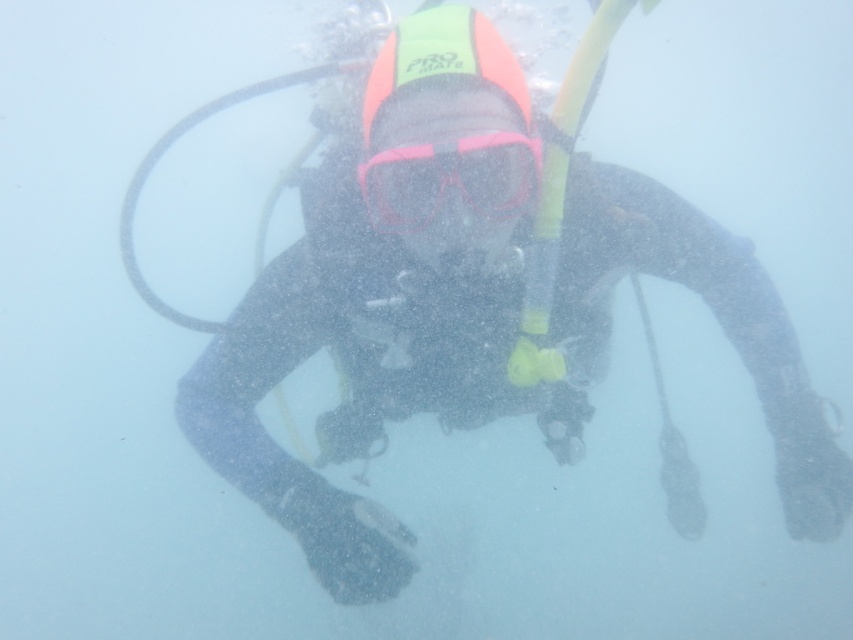
Question: Is black matte wetsuit at center positioned in front of pink matte/glossy goggles at center?

Choices:
 (A) no
 (B) yes

Answer: (A)

Question: Does black matte wetsuit at center have a lesser width compared to pink matte/glossy goggles at center?

Choices:
 (A) no
 (B) yes

Answer: (A)

Question: Does black matte wetsuit at center appear under pink matte/glossy goggles at center?

Choices:
 (A) no
 (B) yes

Answer: (B)

Question: Which point is closer to the camera?

Choices:
 (A) (514, 186)
 (B) (325, 218)

Answer: (A)

Question: Which point is closer to the camera?

Choices:
 (A) black matte wetsuit at center
 (B) pink matte/glossy goggles at center

Answer: (B)